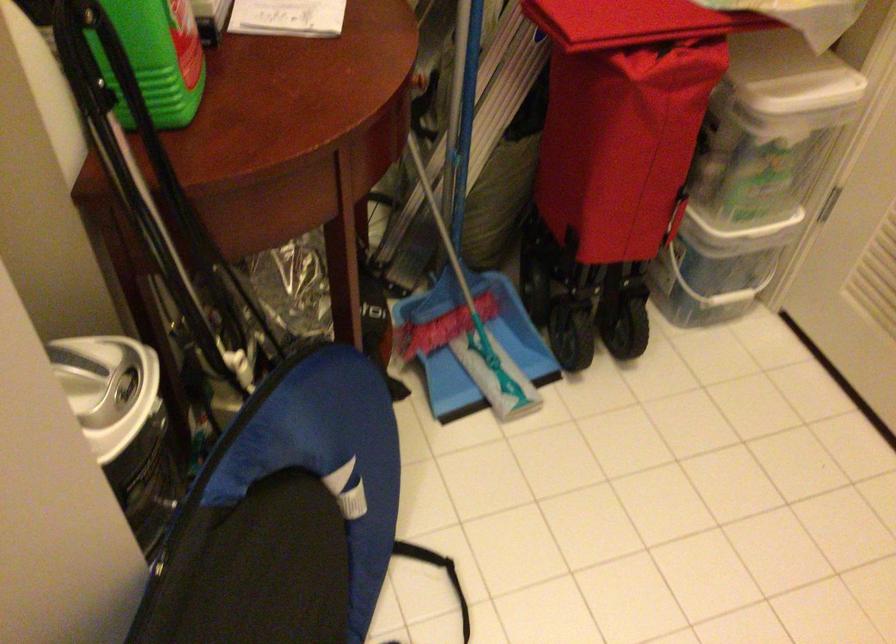
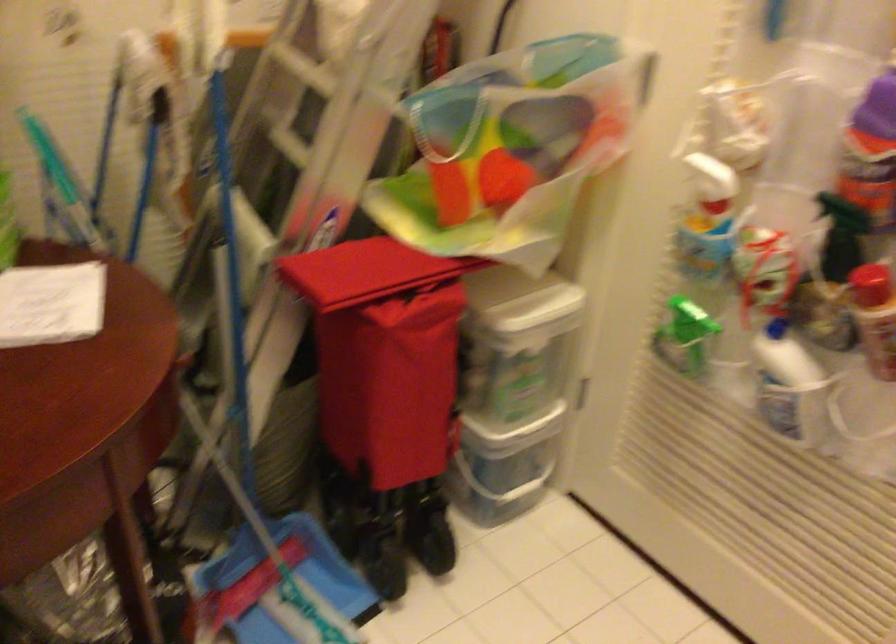
Question: Which direction would the cameraman need to move to produce the second image? Reply with the corresponding letter.

Choices:
 (A) Left
 (B) Right
 (C) Forward
 (D) Backward

Answer: (D)